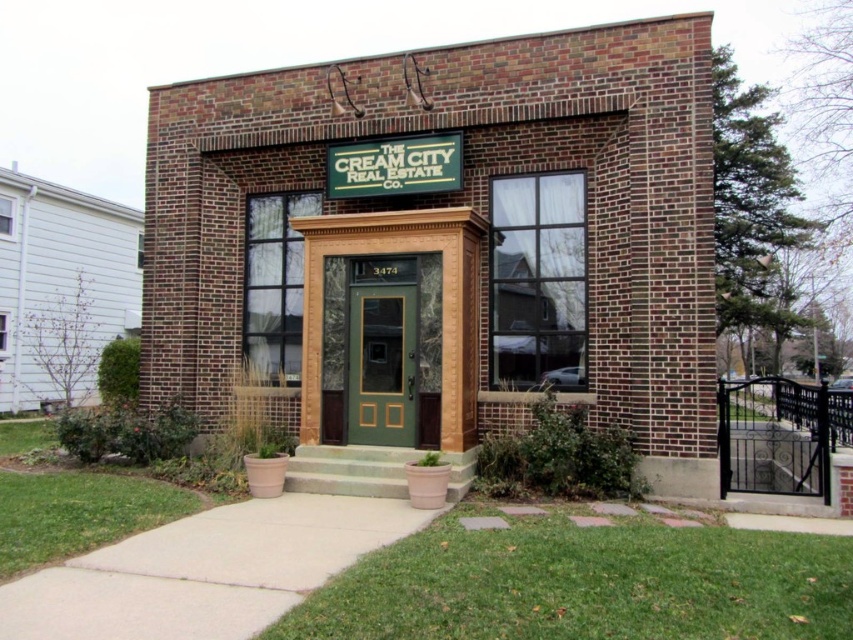
Question: Is green marble door at center positioned at the back of green matte door at center?

Choices:
 (A) yes
 (B) no

Answer: (B)

Question: Is green marble door at center positioned in front of green matte door at center?

Choices:
 (A) yes
 (B) no

Answer: (A)

Question: Can you confirm if green marble door at center is wider than green matte door at center?

Choices:
 (A) no
 (B) yes

Answer: (B)

Question: Which point is farther from the camera taking this photo?

Choices:
 (A) (366, 403)
 (B) (421, 264)

Answer: (A)